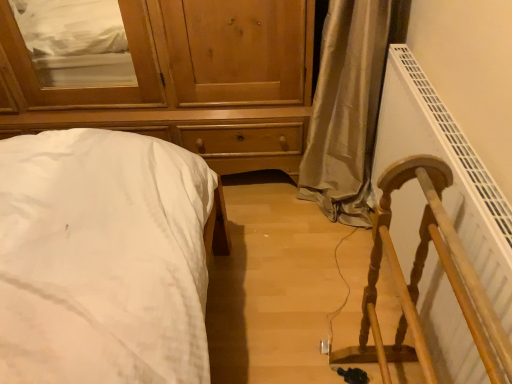
Question: Is wooden chest of drawers at upper left oriented away from white cotton bed at left?

Choices:
 (A) no
 (B) yes

Answer: (A)

Question: Can you confirm if wooden chest of drawers at upper left is positioned to the left of white cotton bed at left?

Choices:
 (A) yes
 (B) no

Answer: (A)

Question: Is white cotton bed at left inside wooden chest of drawers at upper left?

Choices:
 (A) no
 (B) yes

Answer: (A)

Question: Is the depth of wooden chest of drawers at upper left greater than that of white cotton bed at left?

Choices:
 (A) yes
 (B) no

Answer: (A)

Question: Does wooden chest of drawers at upper left have a lesser width compared to white cotton bed at left?

Choices:
 (A) no
 (B) yes

Answer: (B)

Question: Is wooden chest of drawers at upper left smaller than white cotton bed at left?

Choices:
 (A) no
 (B) yes

Answer: (A)

Question: From a real-world perspective, is white cotton bed at left beneath wooden chest of drawers at upper left?

Choices:
 (A) yes
 (B) no

Answer: (A)

Question: Is the position of white cotton bed at left less distant than that of wooden chest of drawers at upper left?

Choices:
 (A) no
 (B) yes

Answer: (B)

Question: Is white cotton bed at left completely or partially outside of wooden chest of drawers at upper left?

Choices:
 (A) no
 (B) yes

Answer: (B)

Question: Is white cotton bed at left shorter than wooden chest of drawers at upper left?

Choices:
 (A) no
 (B) yes

Answer: (B)

Question: Is white cotton bed at left at the left side of wooden chest of drawers at upper left?

Choices:
 (A) no
 (B) yes

Answer: (A)

Question: Is white cotton bed at left thinner than wooden chest of drawers at upper left?

Choices:
 (A) no
 (B) yes

Answer: (A)

Question: Is white plastic radiator at right oriented towards white cotton bed at left?

Choices:
 (A) no
 (B) yes

Answer: (B)